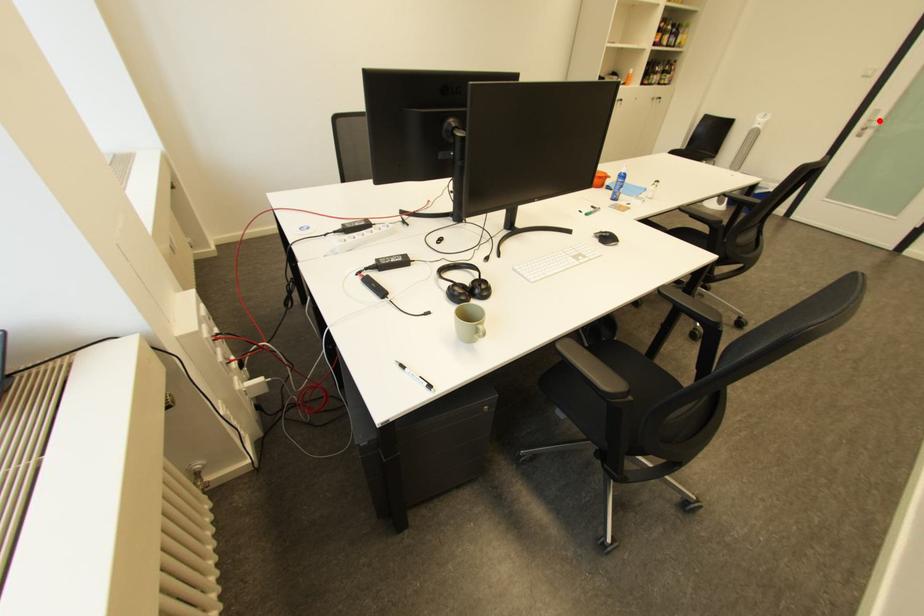
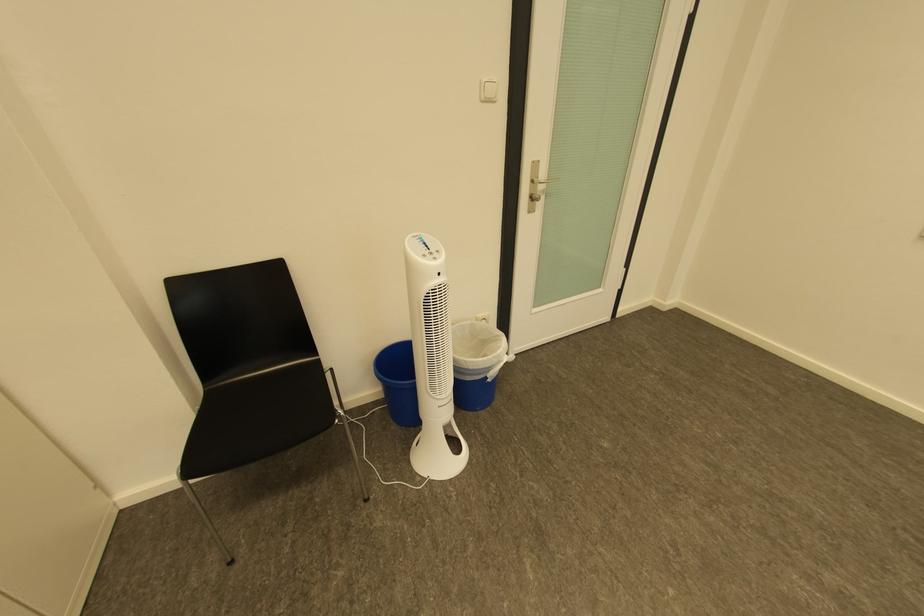
Question: I am providing you with two images of the same scene from different viewpoints. A red point is shown in image1. For the corresponding object point in image2, is it positioned nearer or farther from the camera?

Choices:
 (A) Nearer
 (B) Farther

Answer: (A)